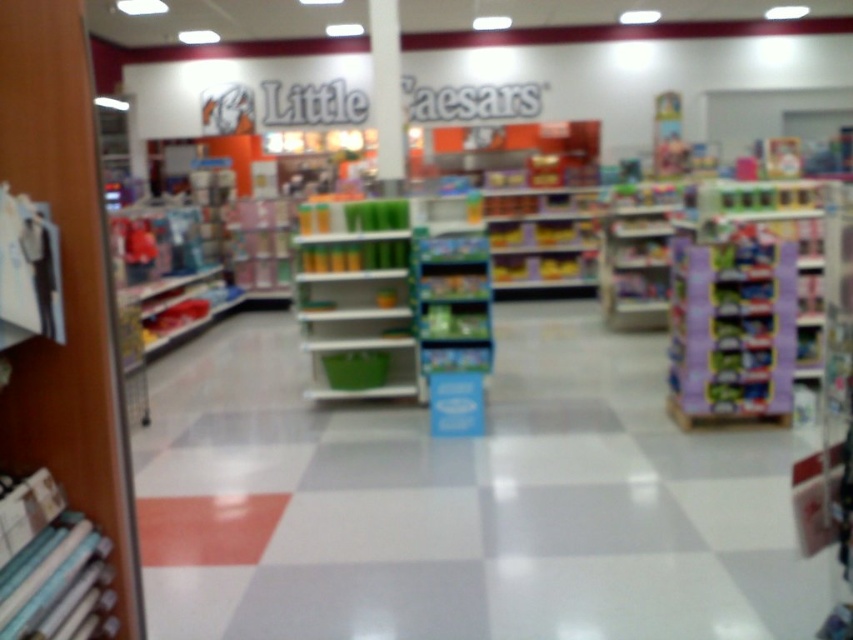
Question: Based on their relative distances, which object is farther from the green plastic shelves at center?

Choices:
 (A) white glossy pillar at center
 (B) purple cardboard candy at right
 (C) white glossy floor at center

Answer: (B)

Question: Among these objects, which one is farthest from the camera?

Choices:
 (A) purple cardboard candy at right
 (B) white glossy pillar at center
 (C) white glossy floor at center
 (D) green plastic shelves at center

Answer: (B)

Question: Which object is the farthest from the white glossy pillar at center?

Choices:
 (A) purple cardboard candy at right
 (B) white glossy floor at center
 (C) green plastic shelves at center

Answer: (A)

Question: Can you confirm if green plastic shelves at center is positioned below white glossy pillar at center?

Choices:
 (A) no
 (B) yes

Answer: (B)

Question: Does white glossy floor at center have a greater width compared to green plastic shelves at center?

Choices:
 (A) yes
 (B) no

Answer: (A)

Question: Is white glossy floor at center to the left of green plastic shelves at center from the viewer's perspective?

Choices:
 (A) no
 (B) yes

Answer: (A)